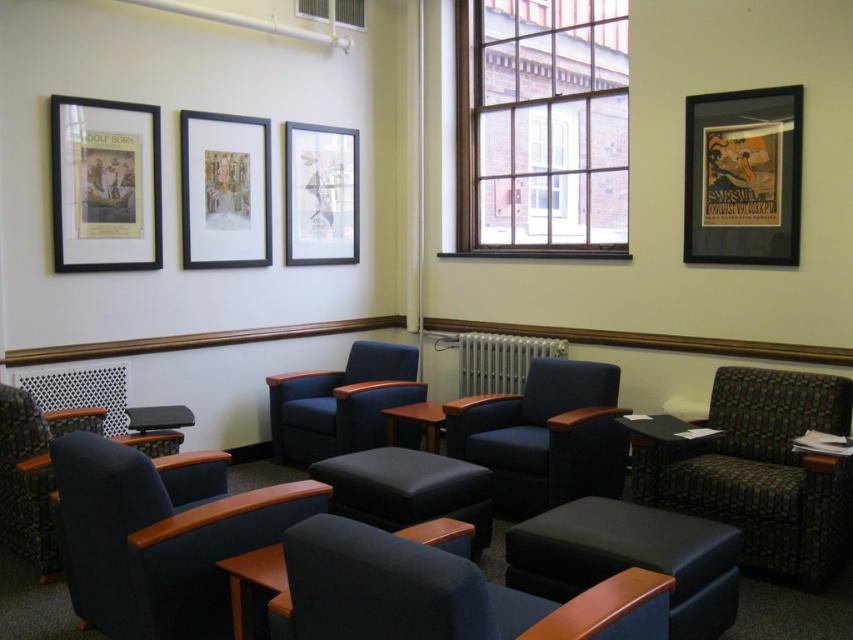
Describe the element at coordinates (762, 470) in the screenshot. This screenshot has height=640, width=853. I see `patterned fabric chair at right` at that location.

Is patterned fabric chair at right behind matte black stool at center?

No.

Between point (805, 410) and point (454, 516), which one is positioned behind?

The point (805, 410) is more distant.

Locate an element on the screen. patterned fabric chair at right is located at coordinates (762, 470).

Is patterned fabric chair at right to the left of matte blue chair at lower left from the viewer's perspective?

No, patterned fabric chair at right is not to the left of matte blue chair at lower left.

Is patterned fabric chair at right further to the viewer compared to matte blue chair at lower left?

That is False.

Is point (753, 564) closer to viewer compared to point (32, 522)?

That is False.

Identify the location of patterned fabric chair at right. click(x=762, y=470).

Does point (474, 150) come closer to viewer compared to point (228, 237)?

No, it is not.

Looking at this image, who is positioned more to the right, brown wooden window at center or matte paper picture frame at center?

brown wooden window at center is more to the right.

The image size is (853, 640). What do you see at coordinates (541, 128) in the screenshot?
I see `brown wooden window at center` at bounding box center [541, 128].

Find the location of a particular element. brown wooden window at center is located at coordinates click(541, 128).